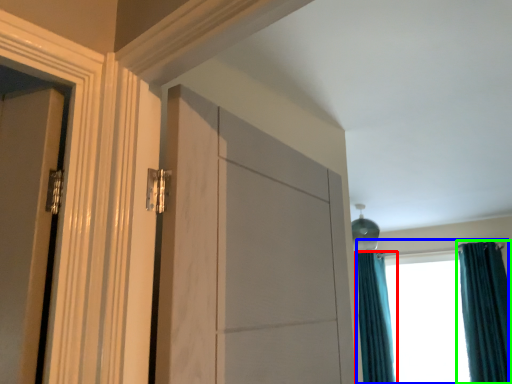
Question: Based on their relative distances, which object is farther from curtain (highlighted by a red box)? Choose from window (highlighted by a blue box) and curtain (highlighted by a green box).

Choices:
 (A) window
 (B) curtain

Answer: (B)